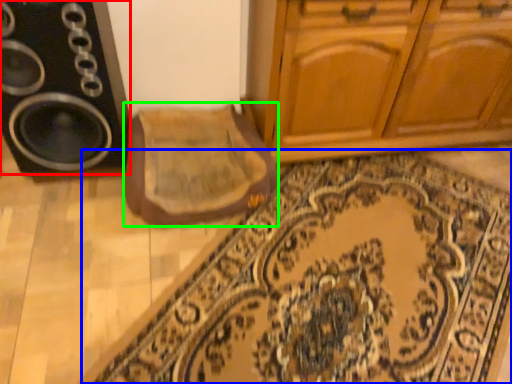
Question: Considering the real-world distances, which object is farthest from speaker (highlighted by a red box)? doormat (highlighted by a blue box) or mat (highlighted by a green box)?

Choices:
 (A) doormat
 (B) mat

Answer: (A)